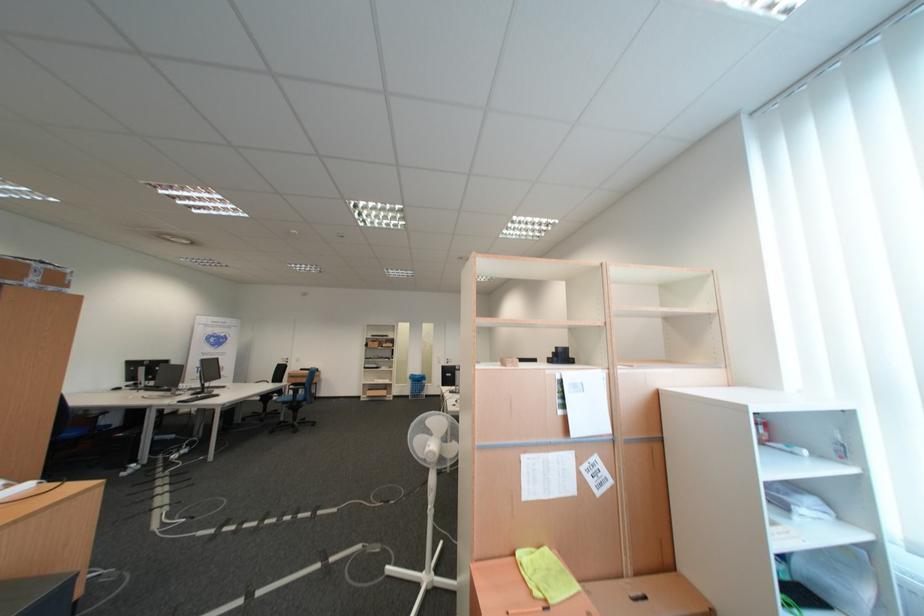
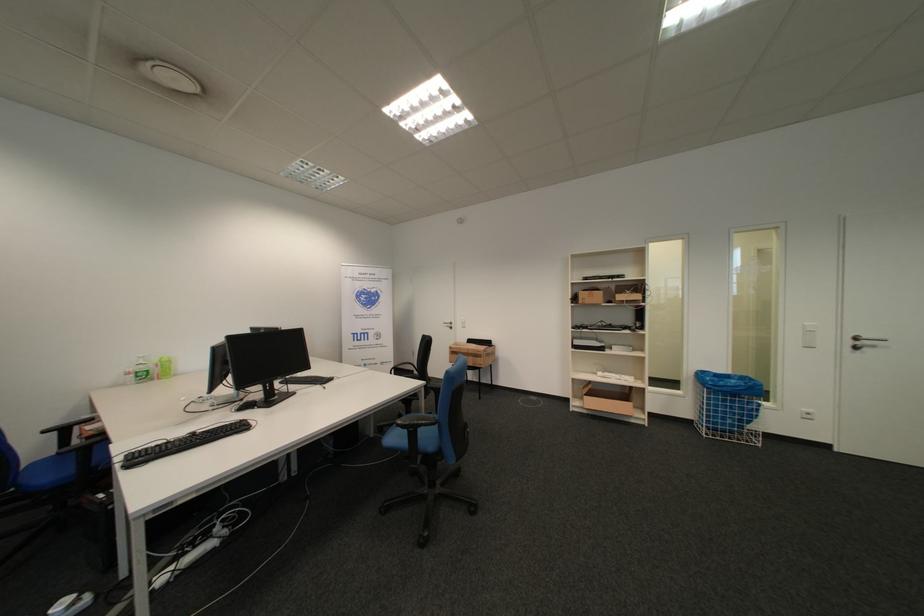
Locate, in the second image, the point that corresponds to (381,391) in the first image.

(601, 395)